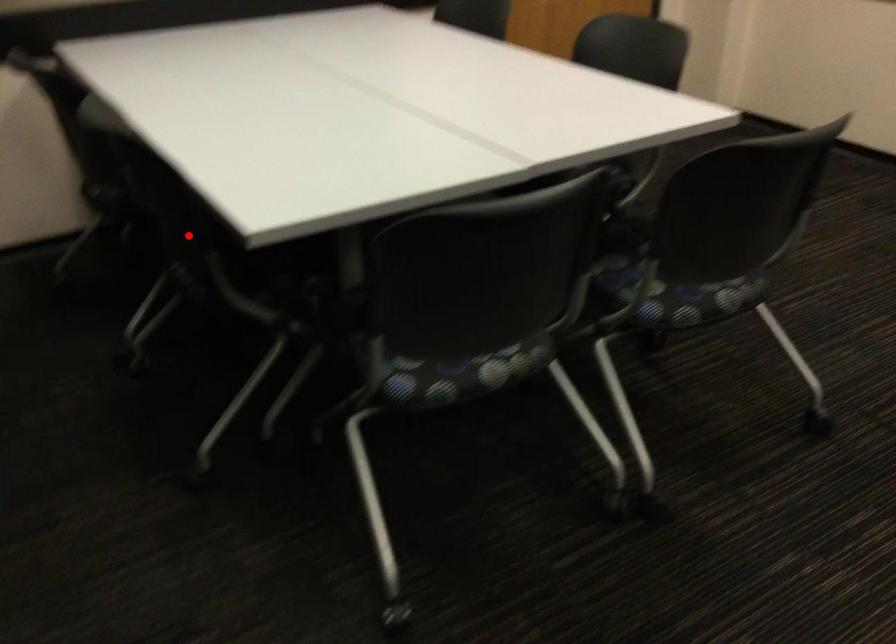
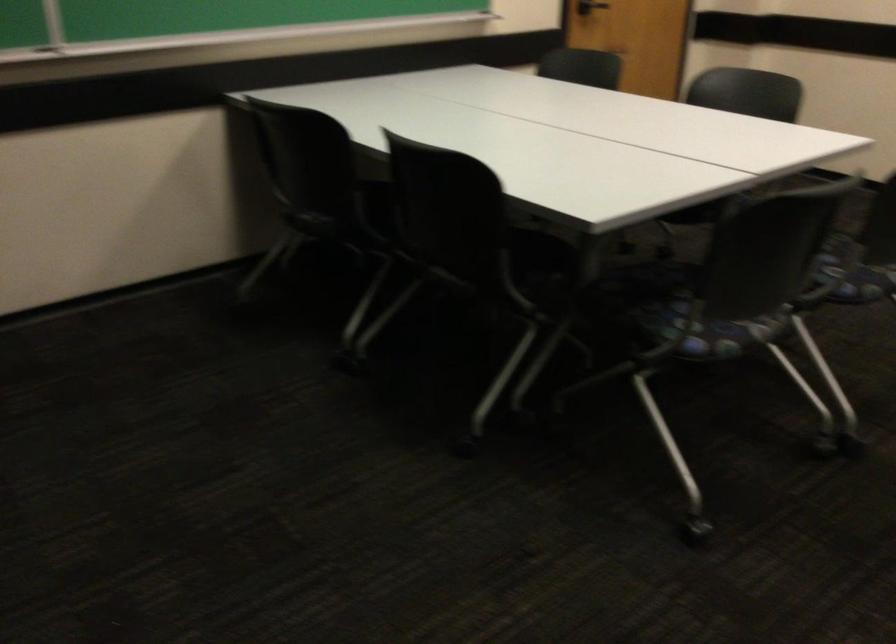
Question: I am providing you with two images of the same scene from different viewpoints. Given a red point in image1, look at the same physical point in image2. Is it:

Choices:
 (A) Closer to the viewpoint
 (B) Farther from the viewpoint

Answer: (B)